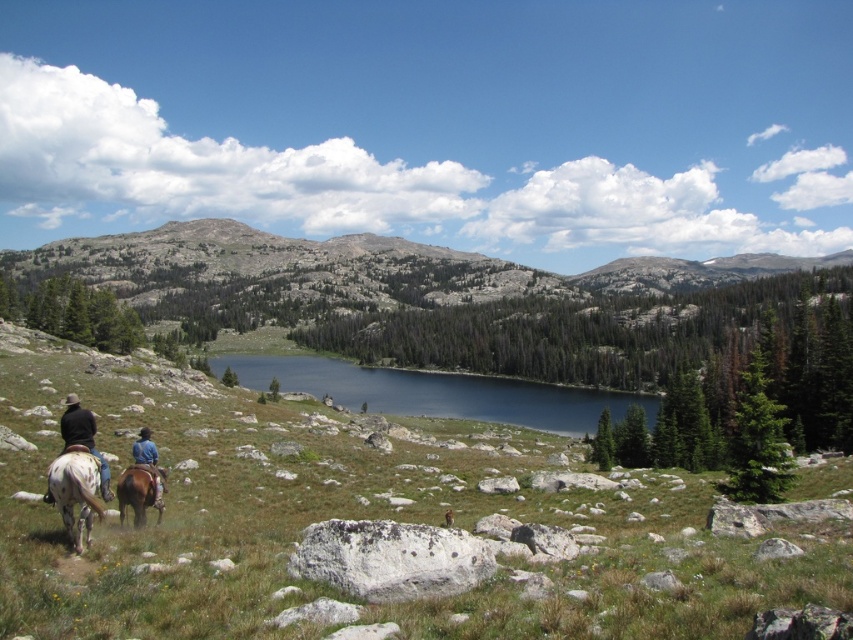
Question: Observing the image, what is the correct spatial positioning of green grassy field at lower center in reference to smooth dark blue water at center?

Choices:
 (A) above
 (B) below

Answer: (A)

Question: Can you confirm if green grassy field at lower center is positioned above dark brown leather jacket at lower left?

Choices:
 (A) yes
 (B) no

Answer: (B)

Question: Which of these objects is positioned closest to the brown glossy horse at lower left?

Choices:
 (A) smooth dark blue water at center
 (B) green grassy field at lower center
 (C) blue denim jeans at lower left
 (D) dappled white horse at lower left

Answer: (C)

Question: Can you confirm if green grassy field at lower center is bigger than brown glossy horse at lower left?

Choices:
 (A) no
 (B) yes

Answer: (B)

Question: Among these points, which one is farthest from the camera?

Choices:
 (A) (209, 435)
 (B) (134, 465)
 (C) (85, 513)
 (D) (138, 445)

Answer: (A)

Question: Which point appears closest to the camera in this image?

Choices:
 (A) (152, 470)
 (B) (160, 506)
 (C) (556, 394)
 (D) (68, 410)

Answer: (D)